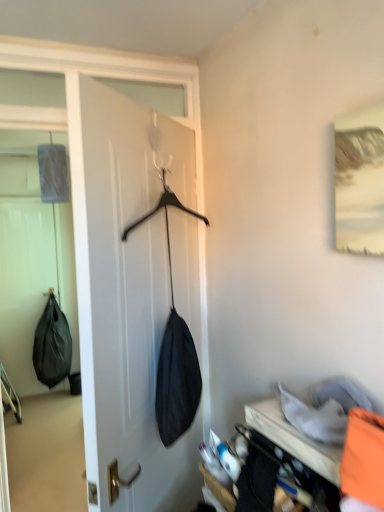
Question: Does black matte shoulder bag at left come in front of orange fabric bag at lower right?

Choices:
 (A) no
 (B) yes

Answer: (A)

Question: Does black matte shoulder bag at left have a greater width compared to orange fabric bag at lower right?

Choices:
 (A) no
 (B) yes

Answer: (B)

Question: Is orange fabric bag at lower right a part of black matte shoulder bag at left?

Choices:
 (A) no
 (B) yes

Answer: (A)

Question: Considering the relative sizes of black matte shoulder bag at left and orange fabric bag at lower right in the image provided, is black matte shoulder bag at left shorter than orange fabric bag at lower right?

Choices:
 (A) no
 (B) yes

Answer: (A)

Question: From a real-world perspective, is black matte shoulder bag at left under orange fabric bag at lower right?

Choices:
 (A) yes
 (B) no

Answer: (A)

Question: From a real-world perspective, is black matte shoulder bag at left positioned above or below black matte coat hanger at center?

Choices:
 (A) above
 (B) below

Answer: (B)

Question: Does point (43, 362) appear closer or farther from the camera than point (150, 483)?

Choices:
 (A) closer
 (B) farther

Answer: (B)

Question: Considering the positions of black matte shoulder bag at left and black matte coat hanger at center in the image, is black matte shoulder bag at left bigger or smaller than black matte coat hanger at center?

Choices:
 (A) big
 (B) small

Answer: (B)

Question: In the image, is black matte shoulder bag at left positioned in front of or behind black matte coat hanger at center?

Choices:
 (A) front
 (B) behind

Answer: (B)

Question: Is black matte coat hanger at center bigger or smaller than orange fabric at lower right?

Choices:
 (A) big
 (B) small

Answer: (A)

Question: Is black matte coat hanger at center taller or shorter than orange fabric at lower right?

Choices:
 (A) tall
 (B) short

Answer: (A)

Question: Does point (104, 90) appear closer or farther from the camera than point (314, 442)?

Choices:
 (A) closer
 (B) farther

Answer: (B)

Question: From the image's perspective, is black matte coat hanger at center above or below orange fabric at lower right?

Choices:
 (A) above
 (B) below

Answer: (A)

Question: Does point (269, 433) appear closer or farther from the camera than point (150, 466)?

Choices:
 (A) farther
 (B) closer

Answer: (B)

Question: From a real-world perspective, is orange fabric pillow at lower right positioned above or below black matte coat hanger at center?

Choices:
 (A) above
 (B) below

Answer: (B)